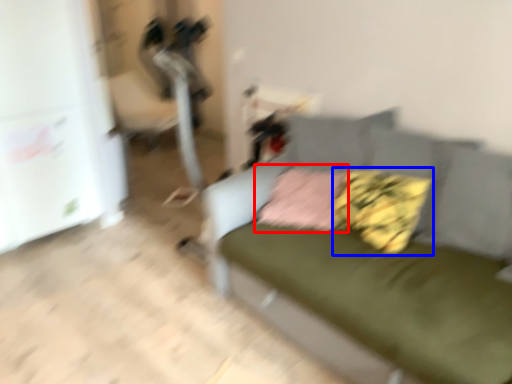
Question: Which point is closer to the camera, pillow (highlighted by a red box) or pillow (highlighted by a blue box)?

Choices:
 (A) pillow
 (B) pillow

Answer: (B)